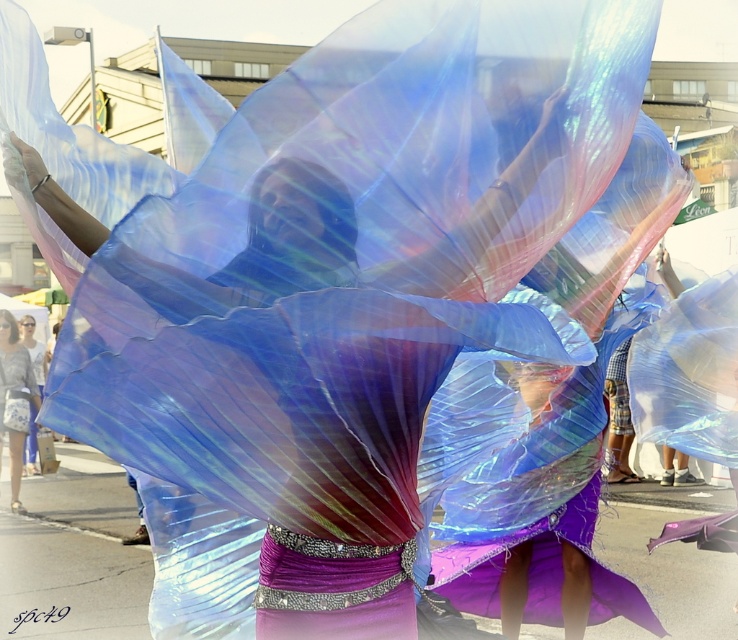
Can you confirm if iridescent fabric wings at center is wider than matte gray shirt at lower left?

Correct, the width of iridescent fabric wings at center exceeds that of matte gray shirt at lower left.

Is the position of iridescent fabric wings at center less distant than that of matte gray shirt at lower left?

Yes.

Is point (230, 317) closer to camera compared to point (13, 369)?

Yes, it is.

Locate an element on the screen. iridescent fabric wings at center is located at coordinates (292, 385).